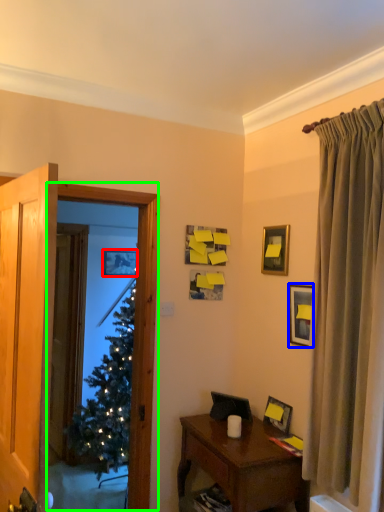
Question: Which object is positioned closest to picture frame (highlighted by a red box)? Select from picture frame (highlighted by a blue box) and window screen (highlighted by a green box).

Choices:
 (A) picture frame
 (B) window screen

Answer: (B)